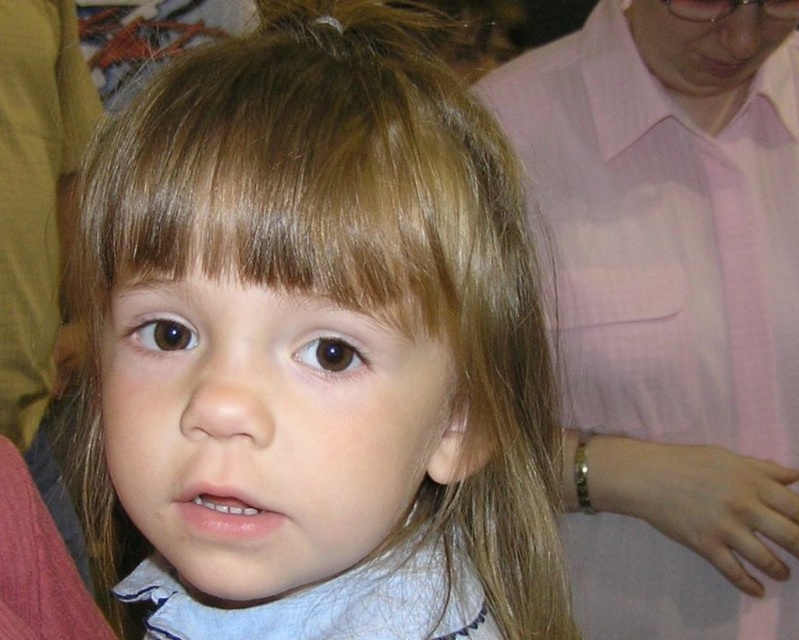
Is blonde hair at center below pink fabric shirt at upper right?

Yes, blonde hair at center is below pink fabric shirt at upper right.

Is blonde hair at center wider than pink fabric shirt at upper right?

No.

Find the location of a particular element. This screenshot has width=799, height=640. blonde hair at center is located at coordinates (315, 348).

At what (x,y) coordinates should I click in order to perform the action: click on blonde hair at center. Please return your answer as a coordinate pair (x, y). Looking at the image, I should click on (315, 348).